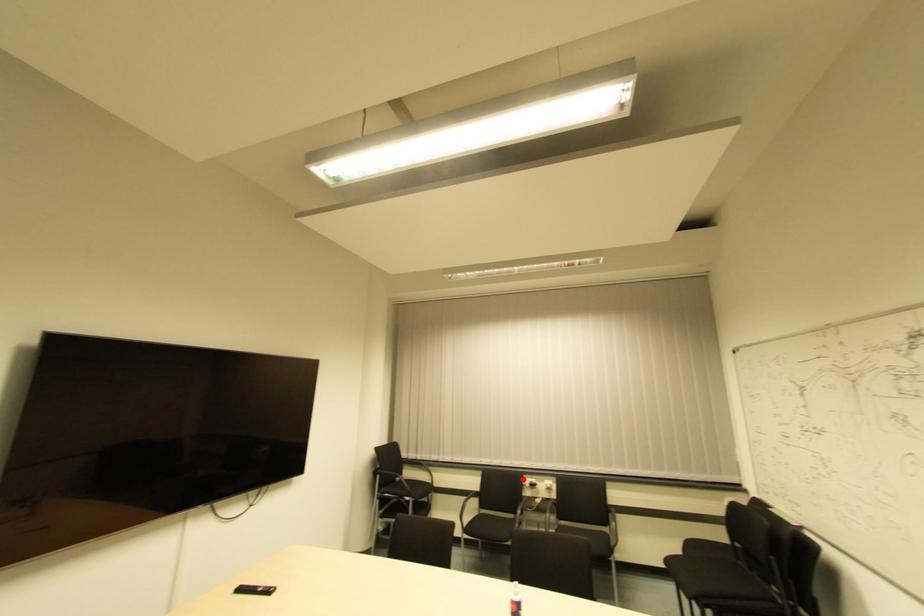
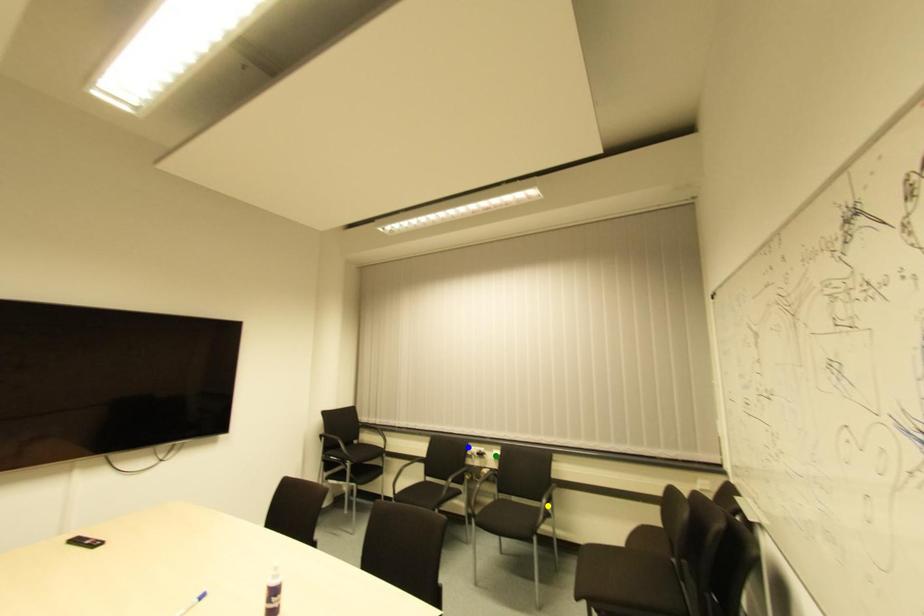
Question: I am providing you with two images of the same scene from different viewpoints. A red point is marked on the first image. You are given multiple points on the second image. Which point in image 2 is actually the same real-world point as the red point in image 1?

Choices:
 (A) yellow point
 (B) green point
 (C) blue point

Answer: (C)